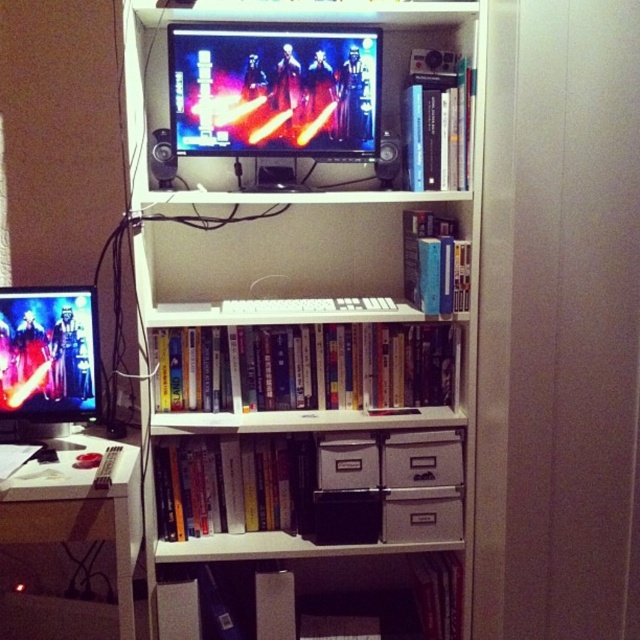
Question: Is the position of matte black monitor at upper center more distant than that of white cardboard drawers at center?

Choices:
 (A) no
 (B) yes

Answer: (A)

Question: Which of these objects is positioned closest to the white plastic computer desk at lower left?

Choices:
 (A) white cardboard drawer at center
 (B) white cardboard drawer at lower center
 (C) matte black monitor at upper center

Answer: (A)

Question: Which object appears closest to the camera in this image?

Choices:
 (A) matte black monitor at upper center
 (B) white matte bookcase at upper center

Answer: (B)

Question: Which point is farther from the camera taking this photo?

Choices:
 (A) (339, 483)
 (B) (445, 524)

Answer: (B)

Question: Is matte black monitor at left behind matte black speaker at upper center?

Choices:
 (A) yes
 (B) no

Answer: (A)

Question: Does matte black monitor at left lie in front of white plastic computer desk at lower left?

Choices:
 (A) yes
 (B) no

Answer: (B)